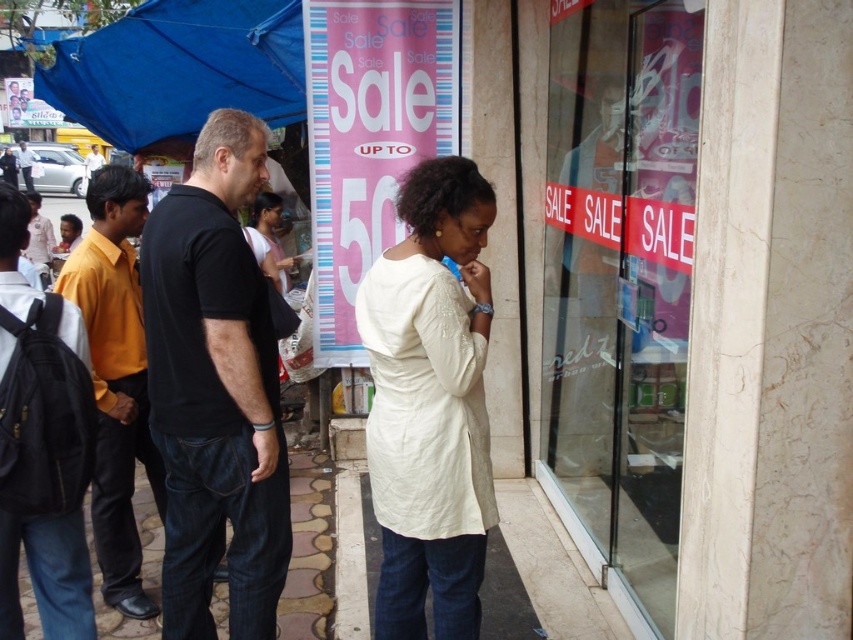
Question: Is white quilted dress at center wider than white shirt at left?

Choices:
 (A) no
 (B) yes

Answer: (B)

Question: Is black cotton t-shirt at center to the right of white quilted dress at center from the viewer's perspective?

Choices:
 (A) yes
 (B) no

Answer: (B)

Question: Is white shirt at left below matte black shirt at left?

Choices:
 (A) no
 (B) yes

Answer: (B)

Question: Which point is closer to the camera?

Choices:
 (A) black backpack at left
 (B) yellow shirt at left

Answer: (A)

Question: Which object is closer to the camera taking this photo?

Choices:
 (A) black backpack at left
 (B) white shirt at left
 (C) transparent glass at center
 (D) black cotton t-shirt at center

Answer: (A)

Question: Which object is closer to the camera taking this photo?

Choices:
 (A) blue fabric canopy at upper left
 (B) yellow shirt at left
 (C) pink fabric shirt at center
 (D) black cotton t-shirt at center

Answer: (D)